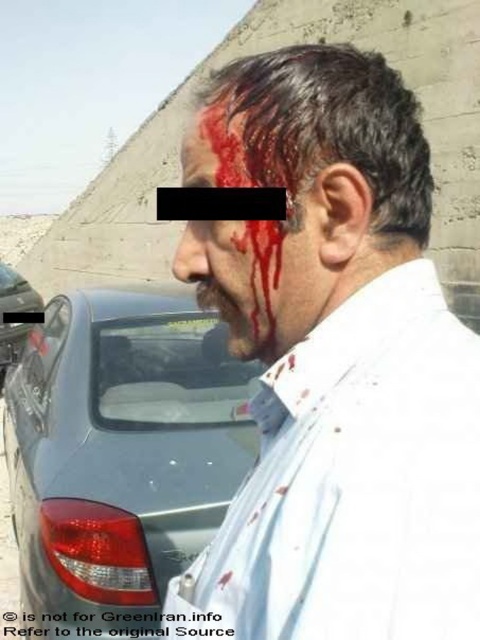
Does matte gray car at left have a lesser width compared to metallic silver car at left?

In fact, matte gray car at left might be wider than metallic silver car at left.

Is point (64, 337) positioned after point (20, 333)?

No, (64, 337) is in front of (20, 333).

Is point (231, 480) behind point (7, 352)?

No.

The height and width of the screenshot is (640, 480). Find the location of `matte gray car at left`. matte gray car at left is located at coordinates (120, 451).

Does point (278, 324) lie in front of point (12, 275)?

Yes, it is in front of point (12, 275).

Is white matte shirt at center smaller than metallic silver car at left?

Indeed, white matte shirt at center has a smaller size compared to metallic silver car at left.

You are a GUI agent. You are given a task and a screenshot of the screen. Output one action in this format:
    pyautogui.click(x=<x>, y=<y>)
    Task: Click on the white matte shirt at center
    The width and height of the screenshot is (480, 640).
    Given the screenshot: What is the action you would take?
    pyautogui.click(x=335, y=362)

You are a GUI agent. You are given a task and a screenshot of the screen. Output one action in this format:
    pyautogui.click(x=<x>, y=<y>)
    Task: Click on the white matte shirt at center
    
    Given the screenshot: What is the action you would take?
    pyautogui.click(x=335, y=362)

Who is higher up, white matte shirt at center or blood-stained skin at center?

blood-stained skin at center is higher up.

Between point (298, 547) and point (225, 248), which one is positioned in front?

Point (298, 547) is more forward.

Which is in front, point (226, 525) or point (197, 168)?

Point (226, 525)

Locate an element on the screen. white matte shirt at center is located at coordinates (335, 362).